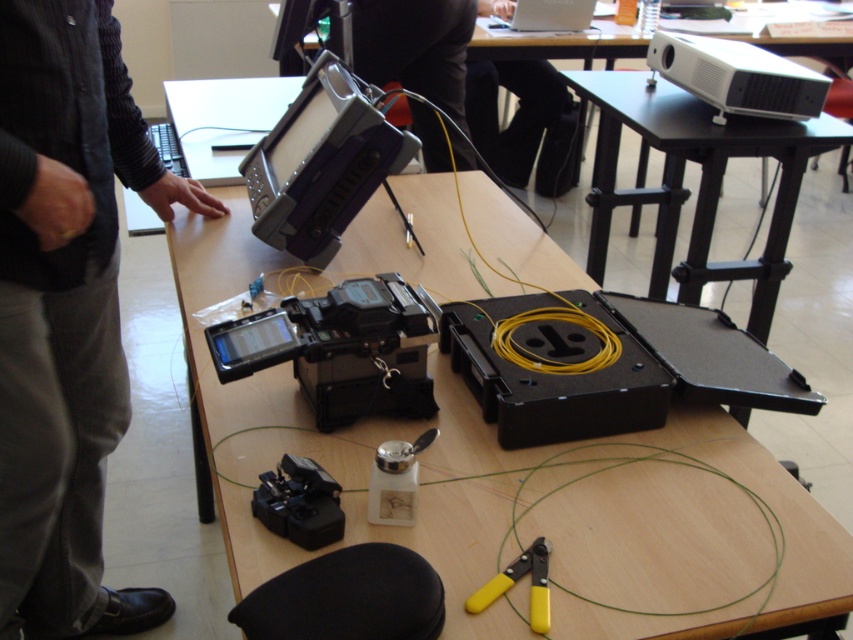
Which is in front, point (18, 120) or point (799, 156)?

Point (18, 120) is in front.

Is dark gray pants at left behind black plastic table at upper center?

No, it is not.

This screenshot has width=853, height=640. What are the coordinates of `dark gray pants at left` in the screenshot? It's located at (67, 310).

Is black fabric pants at upper center bigger than white plastic projector at upper right?

Yes.

Is point (543, 100) farther from camera compared to point (788, 60)?

Yes, it is.

The width and height of the screenshot is (853, 640). I want to click on black fabric pants at upper center, so click(523, 122).

This screenshot has width=853, height=640. I want to click on black plastic video camera at center, so click(341, 348).

Between black plastic video camera at center and purple plastic video camera at center, which one has more height?

With more height is purple plastic video camera at center.

Which is behind, point (378, 308) or point (312, 204)?

The point (312, 204) is more distant.

Where is `black plastic video camera at center`? This screenshot has height=640, width=853. black plastic video camera at center is located at coordinates (341, 348).